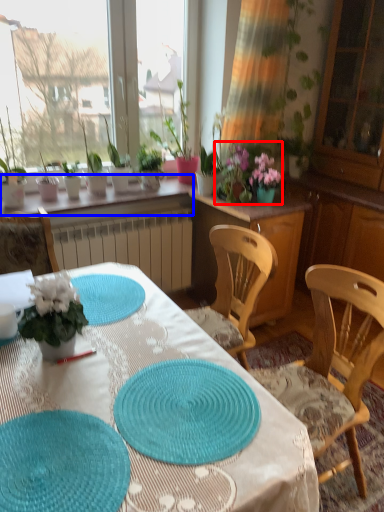
Question: Which of the following is the farthest to the observer, floral arrangement (highlighted by a red box) or window sill (highlighted by a blue box)?

Choices:
 (A) floral arrangement
 (B) window sill

Answer: (A)